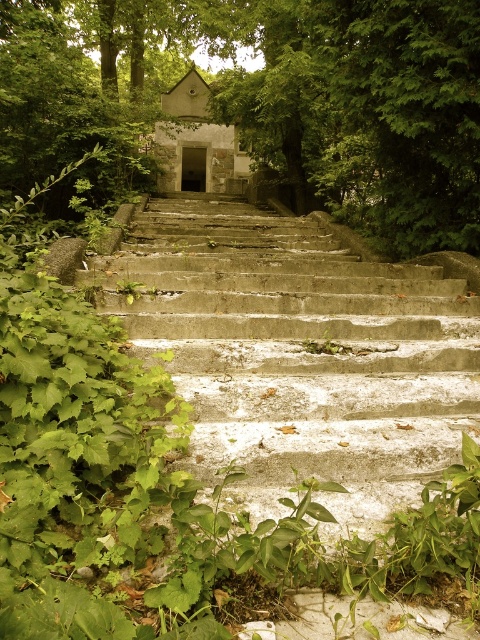
Question: From the image, what is the correct spatial relationship of green leafy tree at center in relation to concrete stairs at center?

Choices:
 (A) below
 (B) above

Answer: (B)

Question: Which point is farther from the camera taking this photo?

Choices:
 (A) (50, 67)
 (B) (274, 465)

Answer: (A)

Question: Can you confirm if green leafy tree at center is bigger than concrete stairs at center?

Choices:
 (A) no
 (B) yes

Answer: (B)

Question: Is green leafy tree at center in front of concrete stairs at center?

Choices:
 (A) no
 (B) yes

Answer: (A)

Question: Which of the following is the farthest from the observer?

Choices:
 (A) green leafy tree at center
 (B) concrete stairs at center

Answer: (A)

Question: Among these points, which one is farthest from the camera?

Choices:
 (A) (105, 20)
 (B) (464, 374)

Answer: (A)